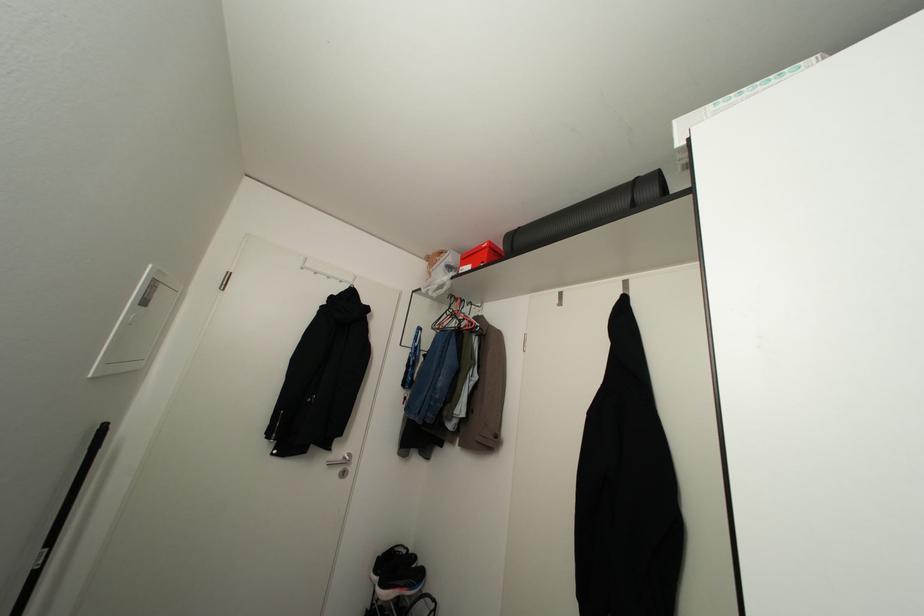
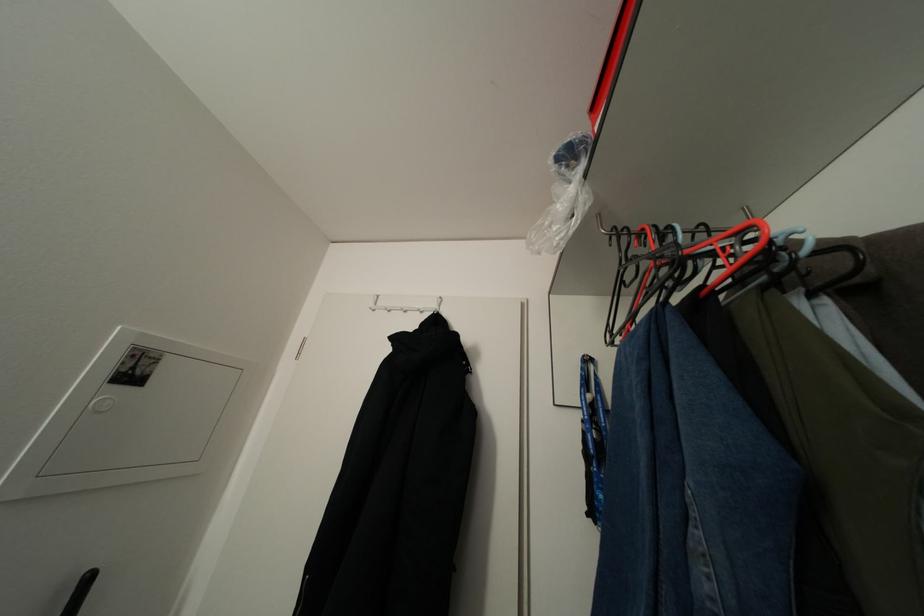
How did the camera likely rotate?

The camera's rotation is toward left-up.